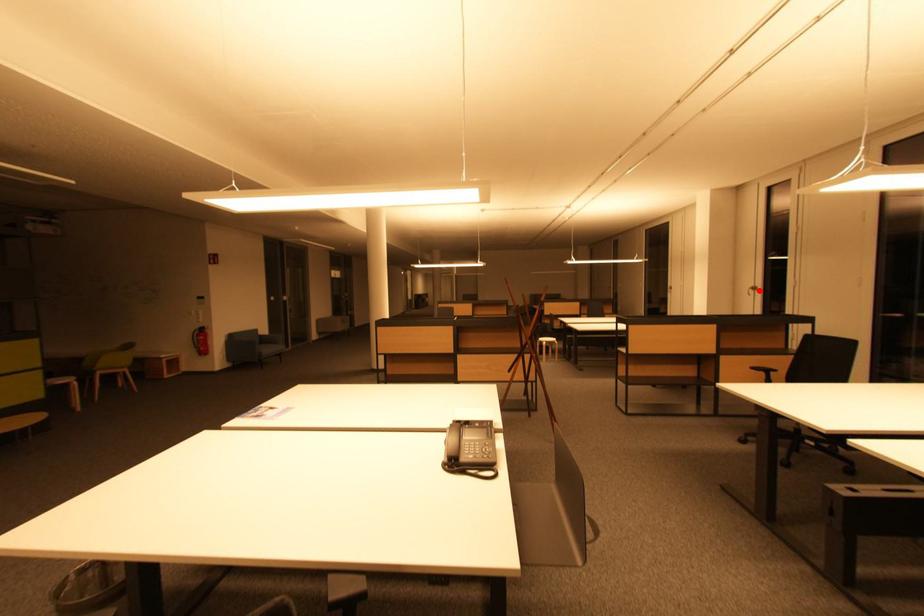
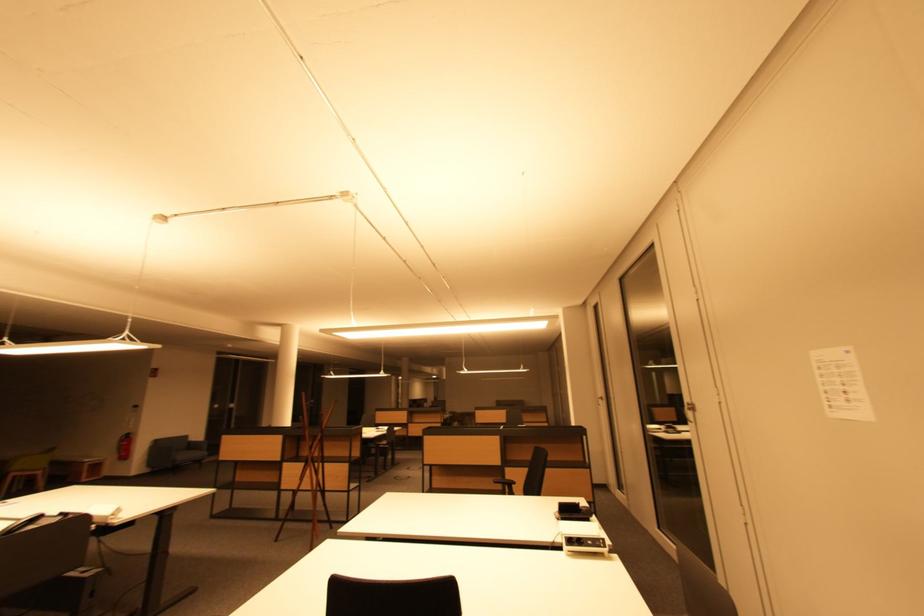
Find the pixel in the second image that matches the highlighted location in the first image.

(605, 400)